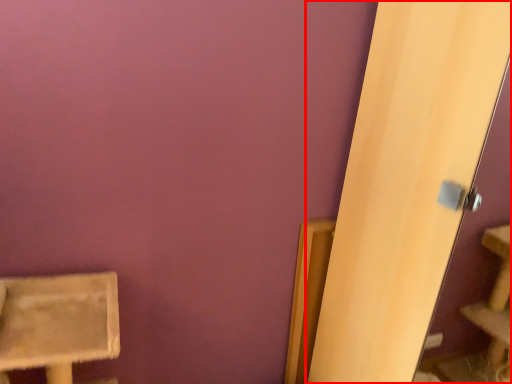
Question: From the image's perspective, where is screen door (annotated by the red box) located relative to furniture?

Choices:
 (A) below
 (B) above

Answer: (B)